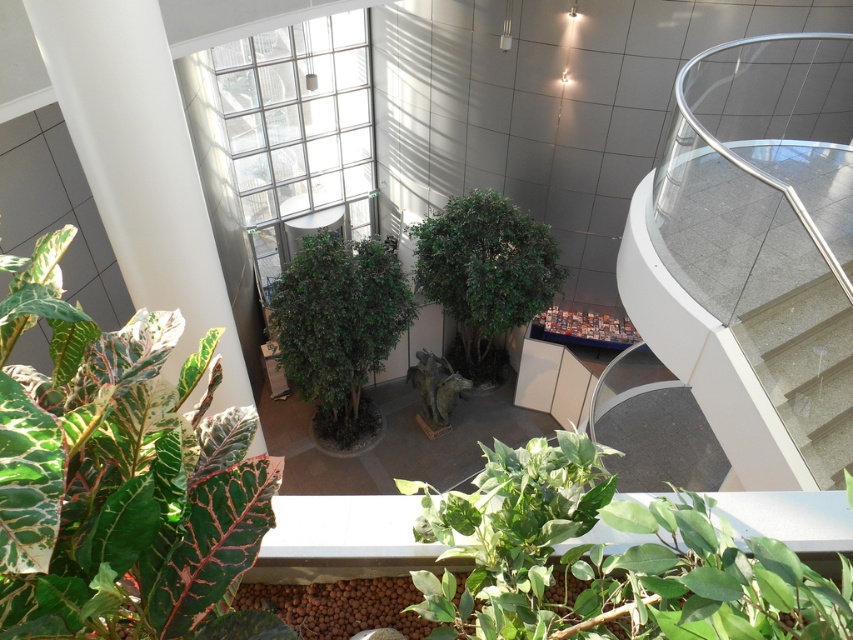
Can you confirm if green matte plant at lower center is taller than green leafy plant at center?

No.

Is green matte plant at lower center shorter than green leafy plant at center?

Correct, green matte plant at lower center is not as tall as green leafy plant at center.

Who is more distant from viewer, (489,628) or (440,230)?

Positioned behind is point (440,230).

This screenshot has width=853, height=640. What are the coordinates of `green matte plant at lower center` in the screenshot? It's located at (608, 560).

Between variegated leafy plant at lower left and green matte tree at center, which one is positioned lower?

green matte tree at center

Does variegated leafy plant at lower left have a lesser width compared to green matte tree at center?

Yes.

Is point (86, 541) closer to viewer compared to point (323, 312)?

Yes, it is.

The width and height of the screenshot is (853, 640). I want to click on variegated leafy plant at lower left, so click(x=120, y=476).

Who is lower down, variegated leafy plant at lower left or green matte plant at lower center?

green matte plant at lower center is below.

Does point (248, 412) lie behind point (491, 611)?

That is False.

This screenshot has width=853, height=640. I want to click on variegated leafy plant at lower left, so click(120, 476).